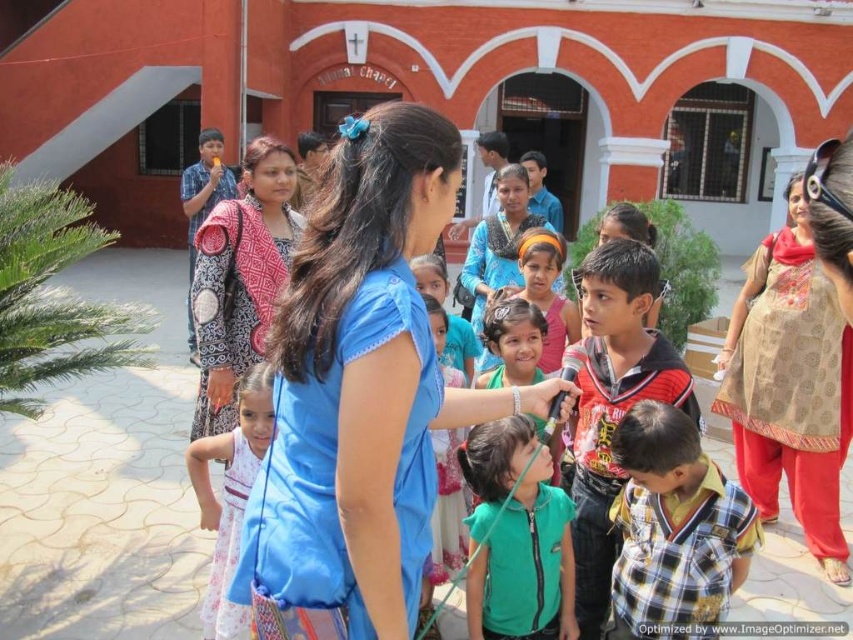
Can you confirm if plaid cotton shirt at center is positioned to the left of white printed dress at center?

Incorrect, plaid cotton shirt at center is not on the left side of white printed dress at center.

Which is in front, point (726, 536) or point (194, 474)?

Point (726, 536)

Where is `plaid cotton shirt at center`? The height and width of the screenshot is (640, 853). plaid cotton shirt at center is located at coordinates (675, 529).

Locate an element on the screen. The width and height of the screenshot is (853, 640). plaid cotton shirt at center is located at coordinates (675, 529).

Is point (842, 388) positioned before point (572, 605)?

No.

Does beige patterned kurta at center have a smaller size compared to green matte vest at center?

No.

Is point (808, 288) positioned before point (480, 474)?

No.

The width and height of the screenshot is (853, 640). What are the coordinates of `beige patterned kurta at center` in the screenshot? It's located at (790, 385).

Where is `blue fabric dress at center`? Image resolution: width=853 pixels, height=640 pixels. blue fabric dress at center is located at coordinates (360, 394).

Consider the image. Does blue fabric dress at center have a larger size compared to striped cotton shirt at center?

Indeed, blue fabric dress at center has a larger size compared to striped cotton shirt at center.

At what (x,y) coordinates should I click in order to perform the action: click on blue fabric dress at center. Please return your answer as a coordinate pair (x, y). Image resolution: width=853 pixels, height=640 pixels. Looking at the image, I should click on (360, 394).